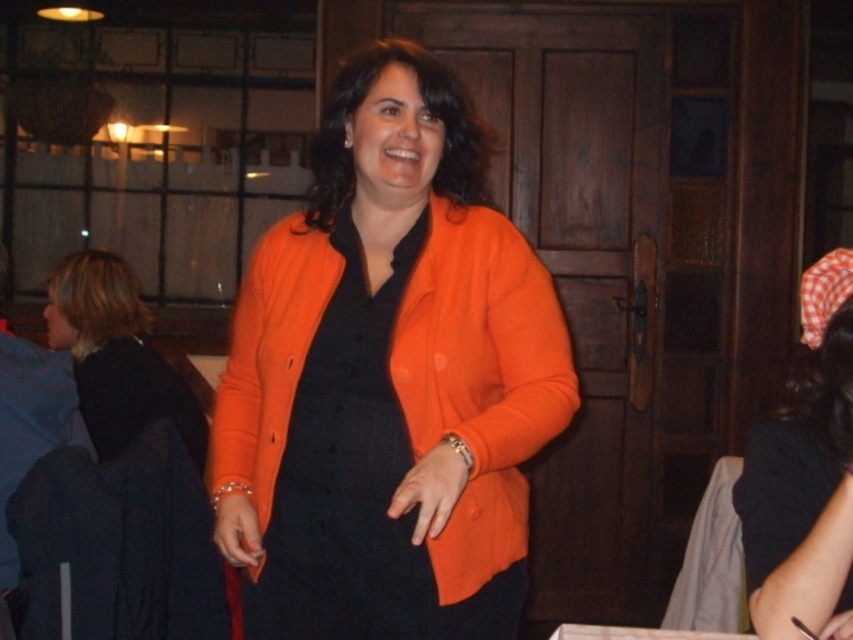
You are a fashion designer observing the image. You need to determine which item of clothing has a narrower width between the orange matte blazer at center and the black matte dress at left. Which one is narrower?

The orange matte blazer at center has a narrower width than the black matte dress at left according to the description.

You are a photographer adjusting your camera settings to focus on the orange matte cardigan at center and the black matte dress at left. Which object should you focus on first to ensure both are in sharp focus?

→ The orange matte cardigan at center is closer to the viewer than the black matte dress at left, so focus on the orange matte cardigan at center first to ensure both are in sharp focus.

You are a photographer trying to capture the woman in the image. You want to ensure both the orange matte cardigan at center and the orange matte blazer at center are clearly visible in your shot. Since the camera can only focus on one object at a time, which one should you focus on to include both in the frame?

The orange matte cardigan at center is positioned on the left side of the orange matte blazer at center, so focusing on the orange matte blazer at center would allow both to be in the frame since the cardigan is to its left.